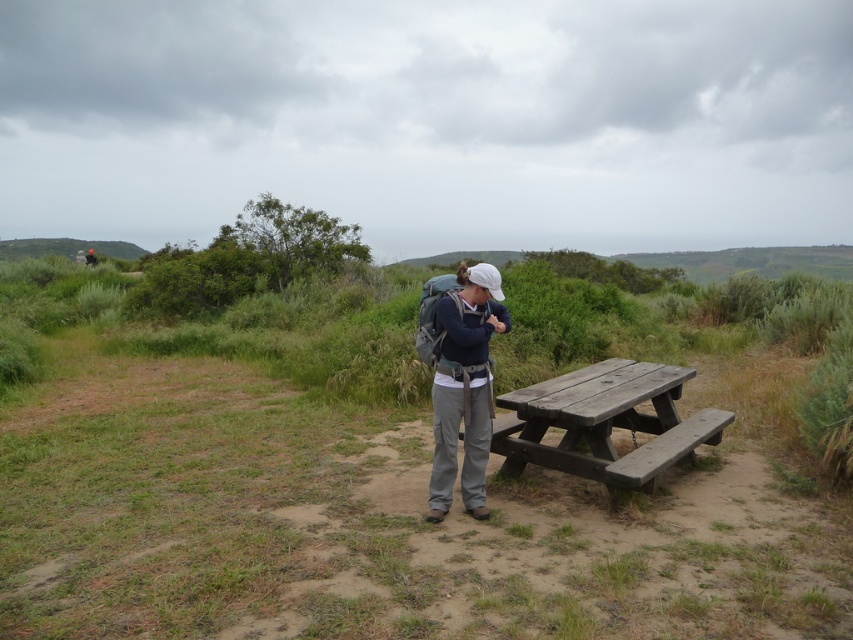
Describe the element at coordinates (370, 481) in the screenshot. I see `green grassy at center` at that location.

What do you see at coordinates (370, 481) in the screenshot? I see `green grassy at center` at bounding box center [370, 481].

Identify the location of green grassy at center. (370, 481).

Does point (541, 403) come closer to viewer compared to point (463, 449)?

Yes, point (541, 403) is in front of point (463, 449).

What do you see at coordinates (604, 422) in the screenshot? The height and width of the screenshot is (640, 853). I see `weathered wood picnic table at center` at bounding box center [604, 422].

Find the location of `weathered wood picnic table at center`. weathered wood picnic table at center is located at coordinates (604, 422).

Between green grassy at center and weathered wood picnic table at center, which one is positioned higher?

green grassy at center is higher up.

Between point (297, 493) and point (619, 476), which one is positioned in front?

Positioned in front is point (619, 476).

Which is behind, point (706, 540) or point (601, 476)?

Point (601, 476)

At what (x,y) coordinates should I click in order to perform the action: click on green grassy at center. Please return your answer as a coordinate pair (x, y). Looking at the image, I should click on (370, 481).